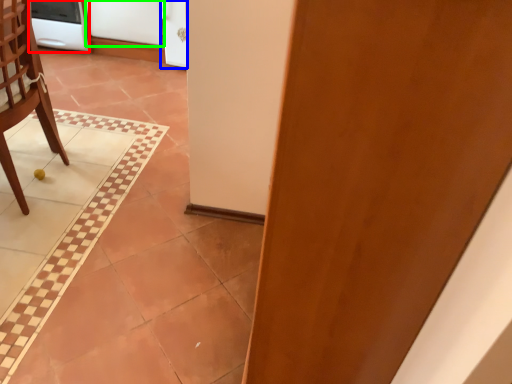
Question: Which is nearer to the appliance (highlighted by a red box)? screen door (highlighted by a blue box) or screen door (highlighted by a green box).

Choices:
 (A) screen door
 (B) screen door

Answer: (B)